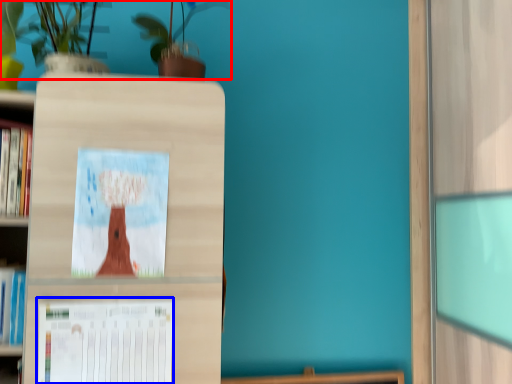
Question: Which object is closer to the camera taking this photo, floral arrangement (highlighted by a red box) or paperback book (highlighted by a blue box)?

Choices:
 (A) floral arrangement
 (B) paperback book

Answer: (A)